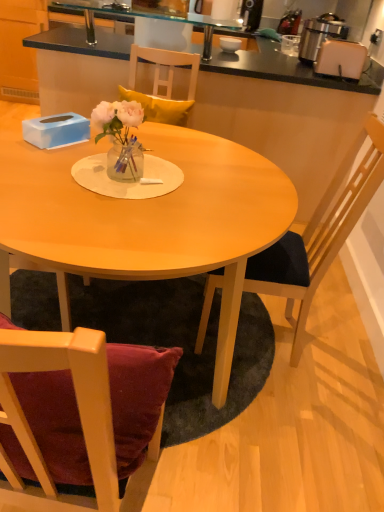
What are the coordinates of `vacant space in front of clear glass vase at center` in the screenshot? It's located at (110, 195).